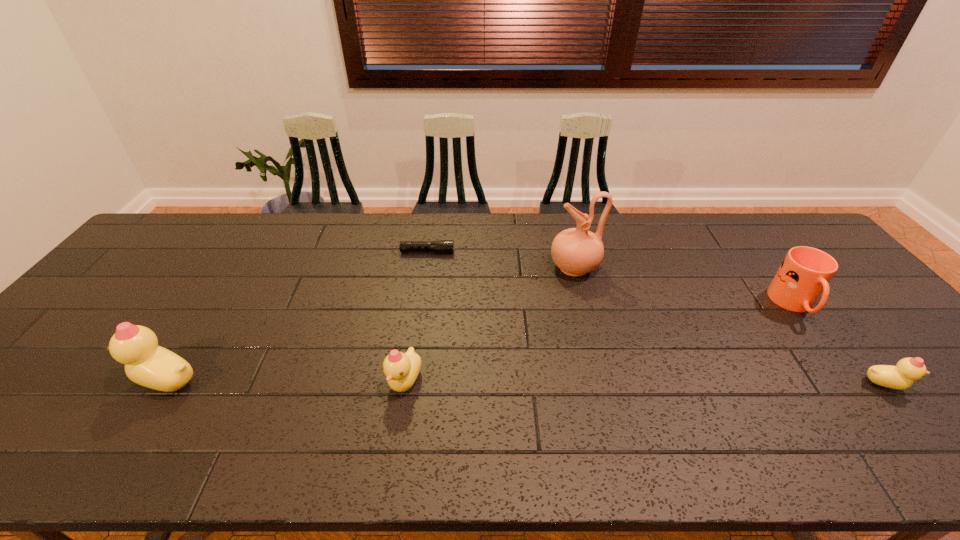
This screenshot has width=960, height=540. Identify the location of free space located 0.180m on the front-facing side of the leftmost object. (56, 380).

The image size is (960, 540). I want to click on blank space located 0.110m on the front-facing side of the leftmost object, so click(85, 380).

Where is `vacant region located on the front-facing side of the rightmost duckling`? The height and width of the screenshot is (540, 960). vacant region located on the front-facing side of the rightmost duckling is located at coordinates (945, 384).

Find the location of a particular element. The width and height of the screenshot is (960, 540). vacant area situated at the lens end of the shortest object is located at coordinates (553, 252).

The height and width of the screenshot is (540, 960). I want to click on free space located 0.210m on the spout of the pottery, so click(481, 267).

You are a GUI agent. You are given a task and a screenshot of the screen. Output one action in this format:
    pyautogui.click(x=<x>, y=<y>)
    Task: Click on the vacant area situated on the spout of the pottery
    Image resolution: width=960 pixels, height=540 pixels.
    Given the screenshot: What is the action you would take?
    pyautogui.click(x=471, y=267)

Locate an element on the screen. The width and height of the screenshot is (960, 540). free location located on the spout of the pottery is located at coordinates (474, 267).

Identify the location of vacant space located on the handle side of the mug. The height and width of the screenshot is (540, 960). (857, 387).

The width and height of the screenshot is (960, 540). I want to click on flashlight positioned at the far edge, so click(440, 246).

You are a GUI agent. You are given a task and a screenshot of the screen. Output one action in this format:
    pyautogui.click(x=<x>, y=<y>)
    Task: Click on the pottery that is positioned at the far edge
    The height and width of the screenshot is (540, 960).
    Given the screenshot: What is the action you would take?
    pyautogui.click(x=576, y=251)